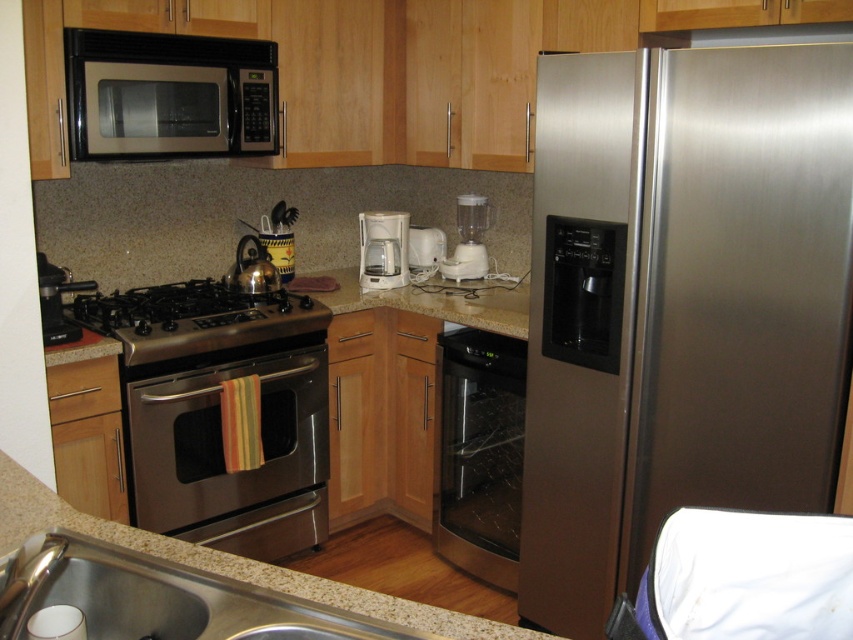
Question: Can you confirm if granite countertop at lower left is positioned to the right of stainless steel gas stove at center?

Choices:
 (A) yes
 (B) no

Answer: (A)

Question: Among these points, which one is farthest from the camera?

Choices:
 (A) (468, 440)
 (B) (136, 492)

Answer: (A)

Question: Is stainless steel gas stove at center thinner than white plastic toaster at center?

Choices:
 (A) yes
 (B) no

Answer: (B)

Question: Does granite countertop at lower left appear on the left side of white plastic coffee machine at center?

Choices:
 (A) no
 (B) yes

Answer: (B)

Question: Which point is closer to the camera taking this photo?

Choices:
 (A) (103, 332)
 (B) (434, 227)

Answer: (A)

Question: Which object is positioned farthest from the stainless steel oven at center?

Choices:
 (A) granite countertop at lower left
 (B) stainless steel gas stove at center
 (C) brushed metal coffee maker at left
 (D) black/stainless steel microwave at upper center

Answer: (A)